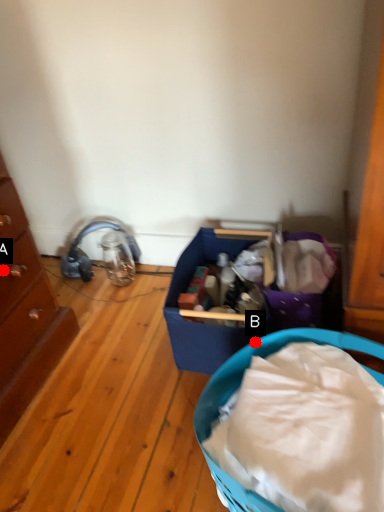
Question: Two points are circled on the image, labeled by A and B beside each circle. Which point is closer to the camera?

Choices:
 (A) A is closer
 (B) B is closer

Answer: (B)